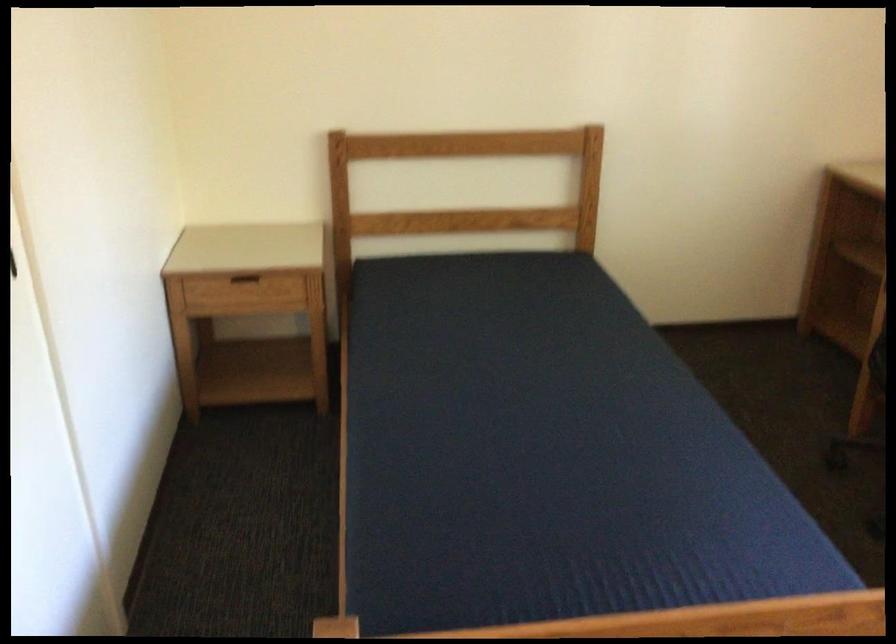
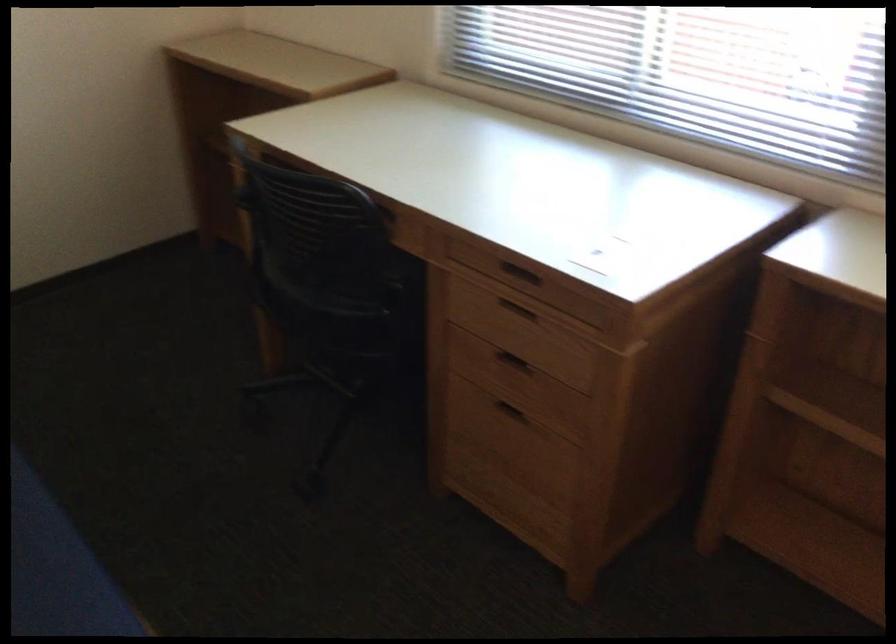
Question: The first image is from the beginning of the video and the second image is from the end. How did the camera likely rotate when shooting the video?

Choices:
 (A) Left
 (B) Right
 (C) Up
 (D) Down

Answer: (B)